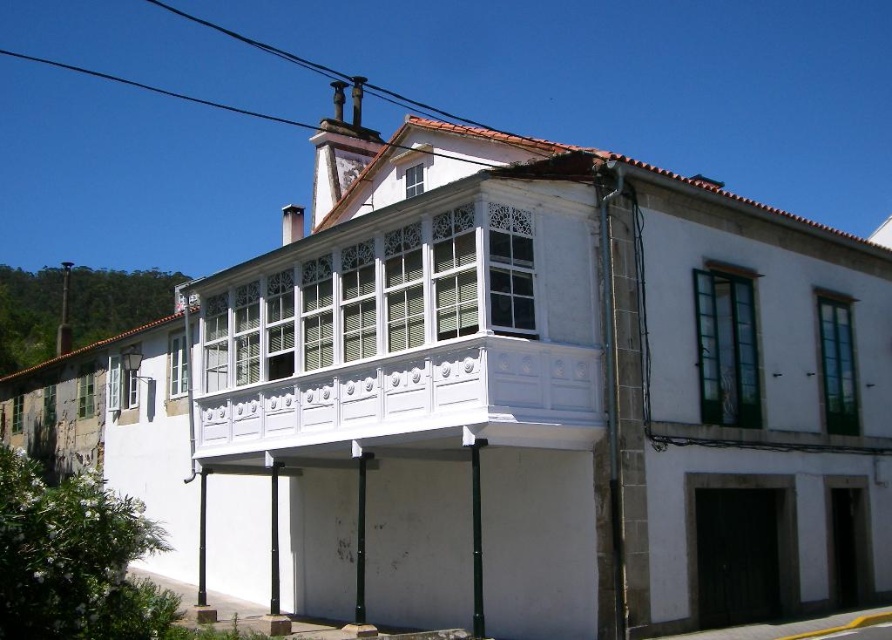
You are an architect designing a new addition to the building. You need to decide whether the white wood balcony at upper center or the black wire at upper center can accommodate a new decorative element. Based on their size, which one has more space available?

The black wire at upper center has more space available because it occupies more space than the white wood balcony at upper center.

You are a window washer standing on the ground in front of the building. You need to clean the white wood balcony at upper center and the black wire at upper center. Which object should you clean first if you want to start from the lower one?

You should clean the white wood balcony at upper center first because it is located below the black wire at upper center, so it is lower than the black wire at upper center.

You are standing in front of the traditional two story building and want to hang a new decorative banner between the white wood balcony at upper center and the black wire at upper center. Based on their heights, will the banner be able to hang properly without touching the ground?

The white wood balcony at upper center is shorter than the black wire at upper center. Since the banner would need to be hung between two points of different heights, it will naturally slope downward from the taller black wire at upper center to the shorter white wood balcony at upper center. This slope means the banner will not touch the ground as it will hang diagonally between the two points.